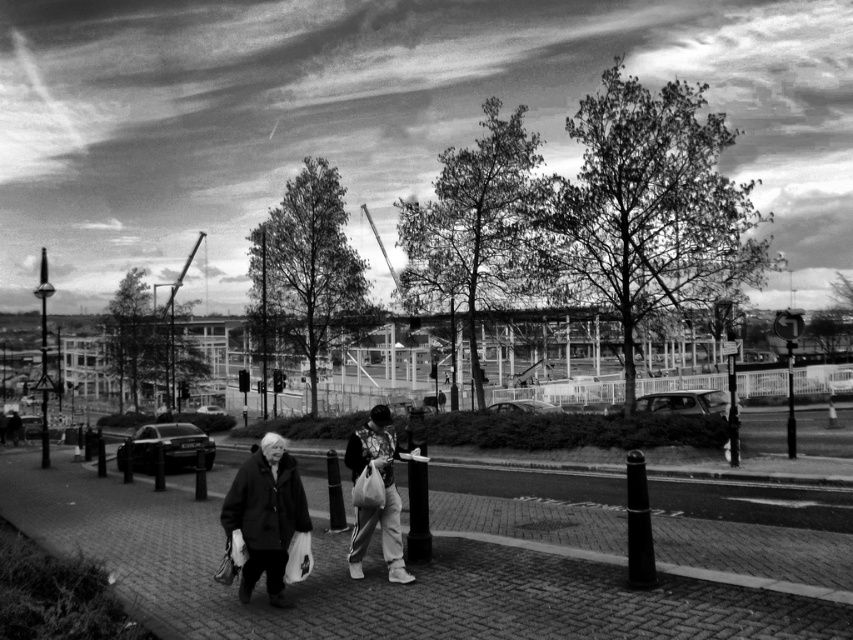
You are a fashion designer analyzing this image for a new collection. You notice a point at coordinate [384,492]. Which object in the scene does this point belong to?

The point at coordinate [384,492] belongs to the patterned fabric jacket at center.

You are a pedestrian standing at the edge of the pathway. You see the dark wool coat at center and the shiny metallic car at center. If you want to cross the road to reach the car, will you have enough space to walk between them?

The dark wool coat at center and the shiny metallic car at center are 81.20 feet apart. Since the distance between them is quite large, you should have enough space to walk between them to reach the car.